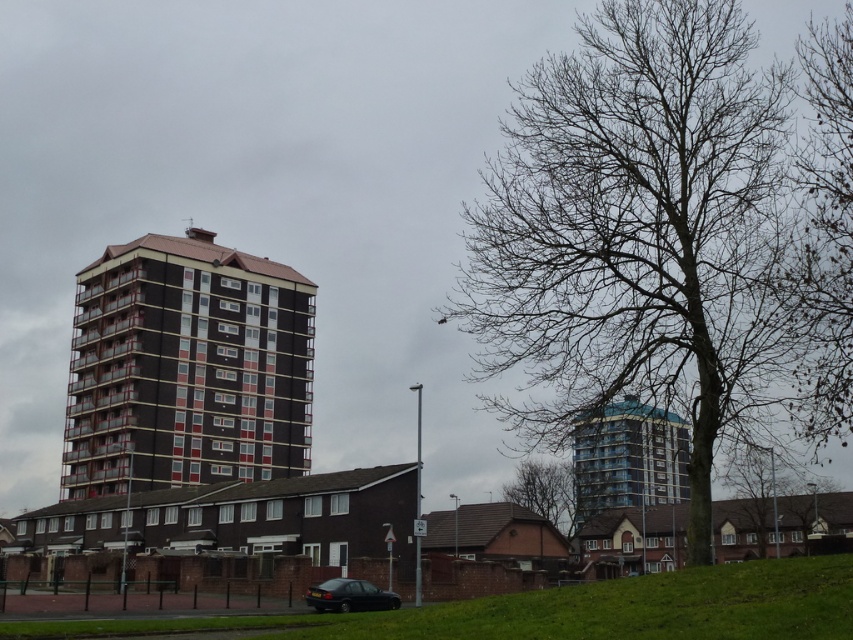
Can you confirm if green grass at lower center is positioned to the left of blue glass building at center?

Correct, you'll find green grass at lower center to the left of blue glass building at center.

Which is more to the right, green grass at lower center or blue glass building at center?

From the viewer's perspective, blue glass building at center appears more on the right side.

Between point (605, 609) and point (601, 499), which one is positioned in front?

Positioned in front is point (605, 609).

Locate an element on the screen. green grass at lower center is located at coordinates click(566, 611).

How much distance is there between brown glossy building at center and bare branches at center?

brown glossy building at center and bare branches at center are 166.10 feet apart from each other.

Who is more forward, (x=177, y=289) or (x=544, y=486)?

Positioned in front is point (x=177, y=289).

Which is in front, point (238, 272) or point (527, 493)?

Point (238, 272) is in front.

You are a GUI agent. You are given a task and a screenshot of the screen. Output one action in this format:
    pyautogui.click(x=<x>, y=<y>)
    Task: Click on the brown glossy building at center
    The height and width of the screenshot is (640, 853).
    Given the screenshot: What is the action you would take?
    pyautogui.click(x=186, y=368)

Between point (724, 74) and point (291, 348), which one is positioned in front?

Point (724, 74)

Is point (592, 104) positioned behind point (161, 376)?

No, (592, 104) is in front of (161, 376).

At what (x,y) coordinates should I click in order to perform the action: click on bare wood tree at center. Please return your answer as a coordinate pair (x, y). Looking at the image, I should click on (650, 236).